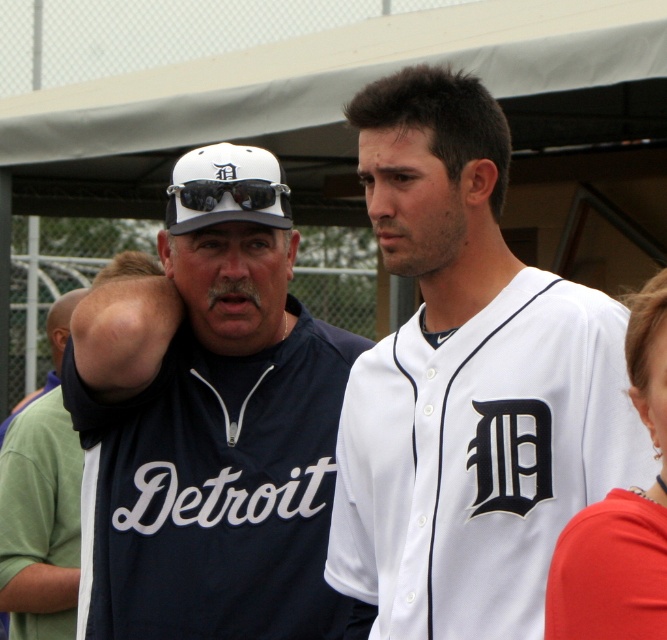
You are a photographer trying to capture a closeup shot of the white jersey at center. The camera you are using has a limited field of view and can only focus on objects within a 0.15 unit radius from the center point. Given that the point at coordinates (468, 384) marks the white jersey at center, will the camera be able to capture the entire white jersey within its focus area?

The point at coordinates (468, 384) marks the white jersey at center. Since the camera can focus within a 0.15 unit radius from the center point, the entire white jersey should be within this radius and thus captured clearly.